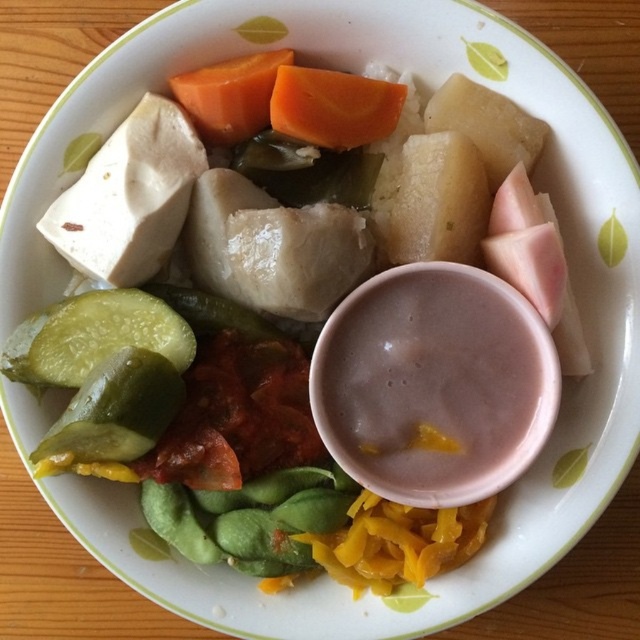
Does white soft tofu at upper left have a smaller size compared to orange smooth carrot at upper center?

No, white soft tofu at upper left is not smaller than orange smooth carrot at upper center.

Between white soft tofu at upper left and orange smooth carrot at upper center, which one appears on the right side from the viewer's perspective?

orange smooth carrot at upper center

Where is `white soft tofu at upper left`? This screenshot has height=640, width=640. white soft tofu at upper left is located at coordinates (129, 196).

I want to click on white soft tofu at upper left, so click(x=129, y=196).

Looking at this image, is the position of green pickled vegetable at lower left less distant than that of orange smooth carrot at center?

Yes, it is.

Can you confirm if green pickled vegetable at lower left is thinner than orange smooth carrot at center?

In fact, green pickled vegetable at lower left might be wider than orange smooth carrot at center.

Between point (129, 348) and point (369, 125), which one is positioned behind?

The point (369, 125) is behind.

I want to click on green pickled vegetable at lower left, so click(116, 410).

Which of these two, green glossy cucumber at lower left or orange smooth carrot at center, stands taller?

green glossy cucumber at lower left

Is green glossy cucumber at lower left thinner than orange smooth carrot at center?

In fact, green glossy cucumber at lower left might be wider than orange smooth carrot at center.

Where is `green glossy cucumber at lower left`? This screenshot has width=640, height=640. green glossy cucumber at lower left is located at coordinates (93, 337).